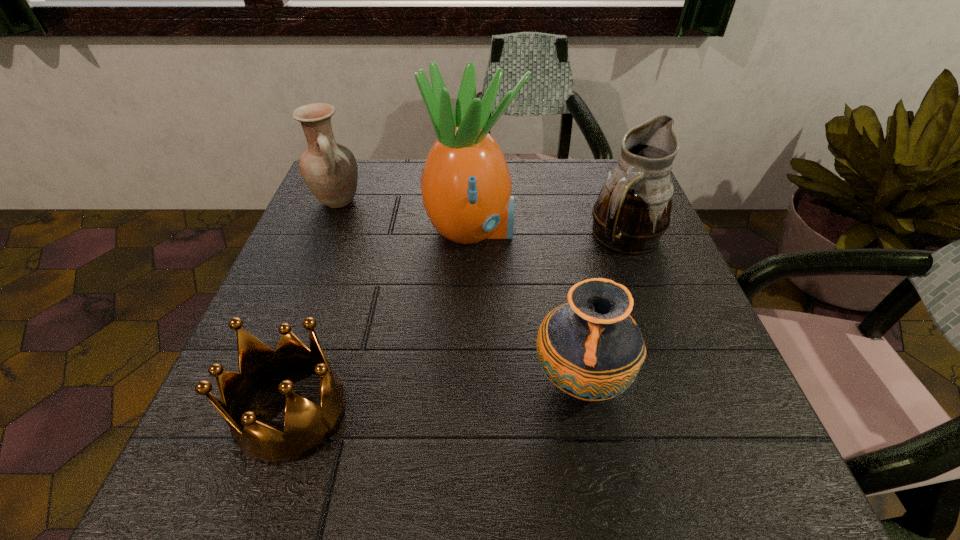
Identify the location of blank space at the near edge of the desktop. The width and height of the screenshot is (960, 540). (625, 465).

Identify the location of blank space at the left edge of the desktop. (355, 272).

Identify the location of vacant space at the right edge of the desktop. The height and width of the screenshot is (540, 960). tap(658, 272).

You are a GUI agent. You are given a task and a screenshot of the screen. Output one action in this format:
    pyautogui.click(x=<x>, y=<y>)
    Task: Click on the free space at the near right corner of the desktop
    The image size is (960, 540).
    Given the screenshot: What is the action you would take?
    pyautogui.click(x=738, y=484)

This screenshot has height=540, width=960. Find the location of `free spot between the farther pottery and the shorter pottery`. free spot between the farther pottery and the shorter pottery is located at coordinates (459, 291).

Locate an element on the screen. The image size is (960, 540). unoccupied position between the pitcher and the crown is located at coordinates (459, 325).

The width and height of the screenshot is (960, 540). Identify the location of vacant region between the crown and the right pottery. (436, 396).

Locate an element on the screen. This screenshot has height=540, width=960. vacant space that's between the pineapple and the pitcher is located at coordinates (549, 234).

Where is `free space between the tallest object and the nearer pottery`? Image resolution: width=960 pixels, height=540 pixels. free space between the tallest object and the nearer pottery is located at coordinates (526, 306).

I want to click on blank region between the shortest object and the farther pottery, so click(x=315, y=307).